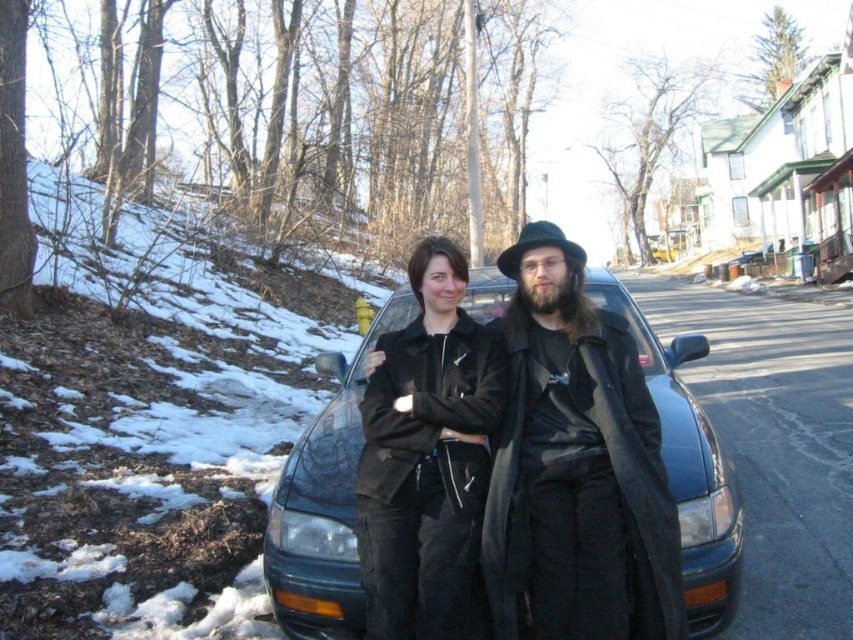
You are a photographer trying to capture both the black matte coat at center and the shiny black car at center in one frame. Based on their sizes, which object should you focus on first to ensure both are in the frame?

The black matte coat at center is shorter than the shiny black car at center. To ensure both are in the frame, focus on the shiny black car at center first as it is taller and requires more space vertically.